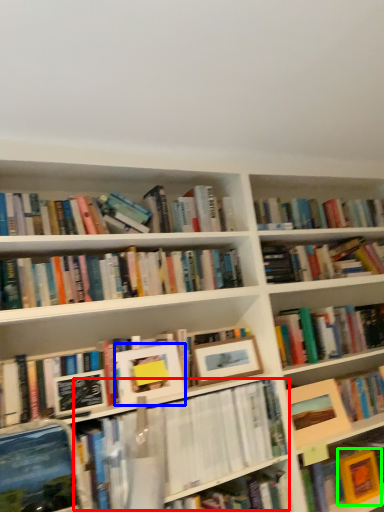
Question: Which object is positioned closest to book (highlighted by a red box)? Select from picture frame (highlighted by a blue box) and paperback book (highlighted by a green box).

Choices:
 (A) picture frame
 (B) paperback book

Answer: (A)